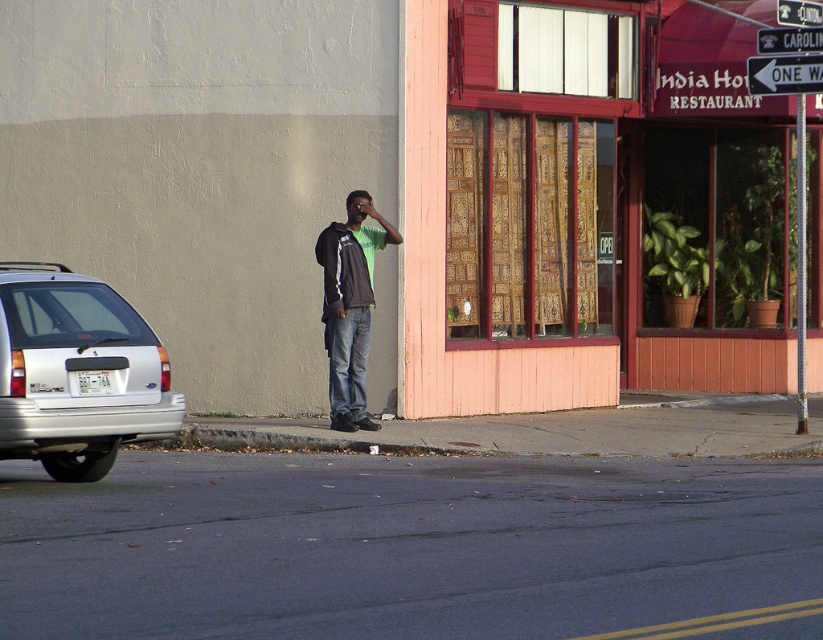
You are driving a car and see the silver metallic hatchback at left and the black plastic one way sign at upper right in your rearview mirror. Which object will appear larger in your mirror?

The silver metallic hatchback at left will appear larger in the mirror because it is closer to the viewer than the black plastic one way sign at upper right.

You are driving a car and see the image. There is a silver metallic hatchback at left located at point (77,372). Can you determine if the silver metallic hatchback at left is parked legally?

The silver metallic hatchback at left is located at point (77,372). Without additional information about parking regulations or the presence of parking lines or restrictions at that specific coordinate, it is impossible to determine if it is parked legally.

You are driving a car and see the silver metallic hatchback at left and the brown jacket at center. Which object is closer to the left side of the road?

The silver metallic hatchback at left is positioned on the left side of brown jacket at center, so it is closer to the left side of the road.